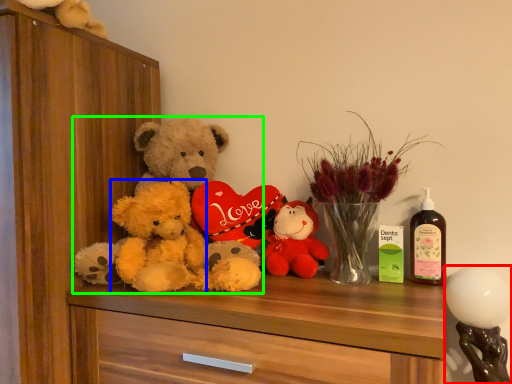
Question: Which is nearer to the toy (highlighted by a red box)? teddy (highlighted by a blue box) or teddy bear (highlighted by a green box).

Choices:
 (A) teddy
 (B) teddy bear

Answer: (B)